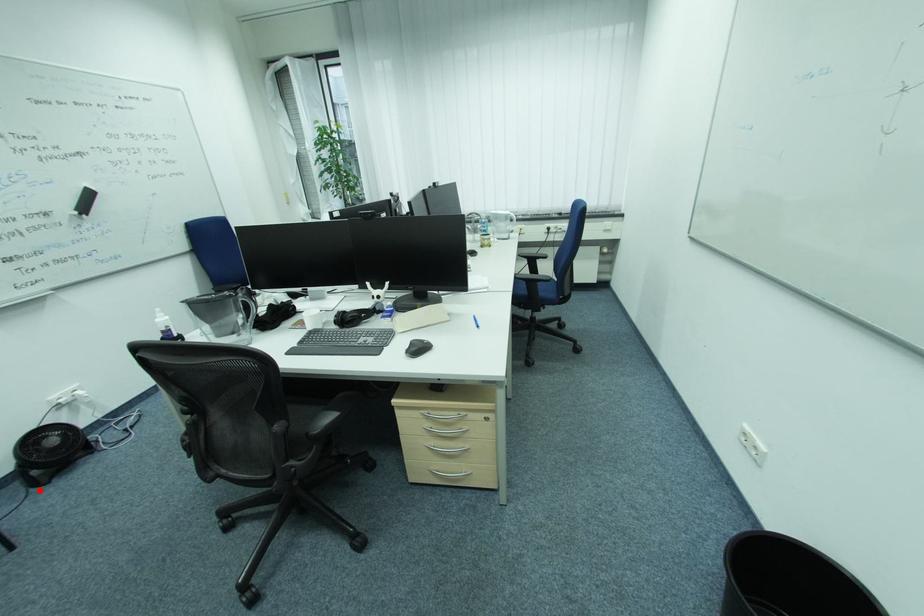
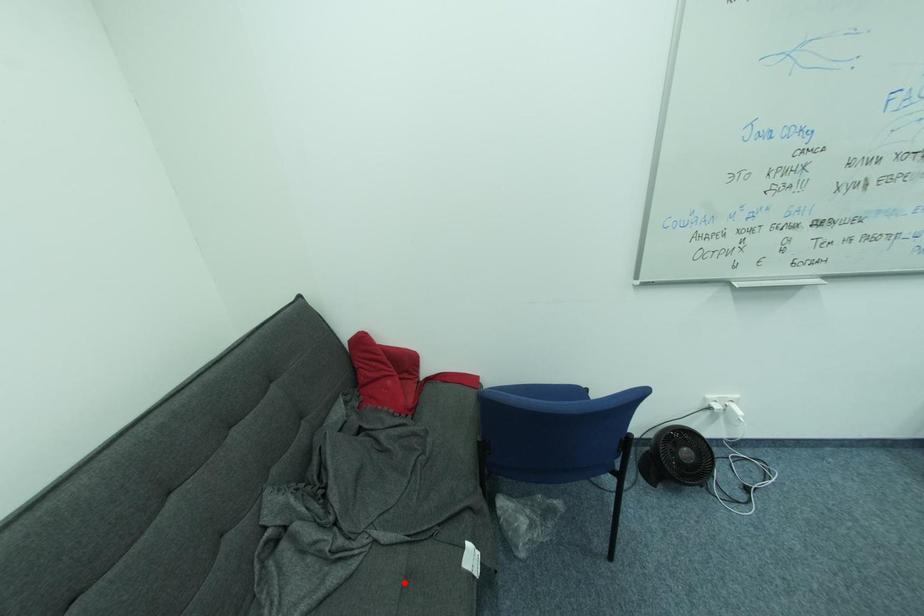
I am providing you with two images of the same scene from different viewpoints. A red point is marked on the first image and another point is marked on the second image. Are the points marked in image1 and image2 representing the same 3D position?

No